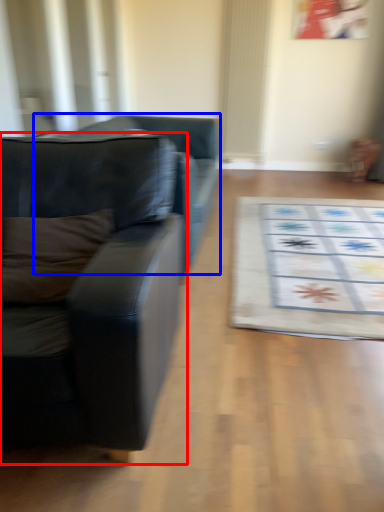
Question: Among these objects, which one is farthest to the camera, studio couch (highlighted by a red box) or studio couch (highlighted by a blue box)?

Choices:
 (A) studio couch
 (B) studio couch

Answer: (B)